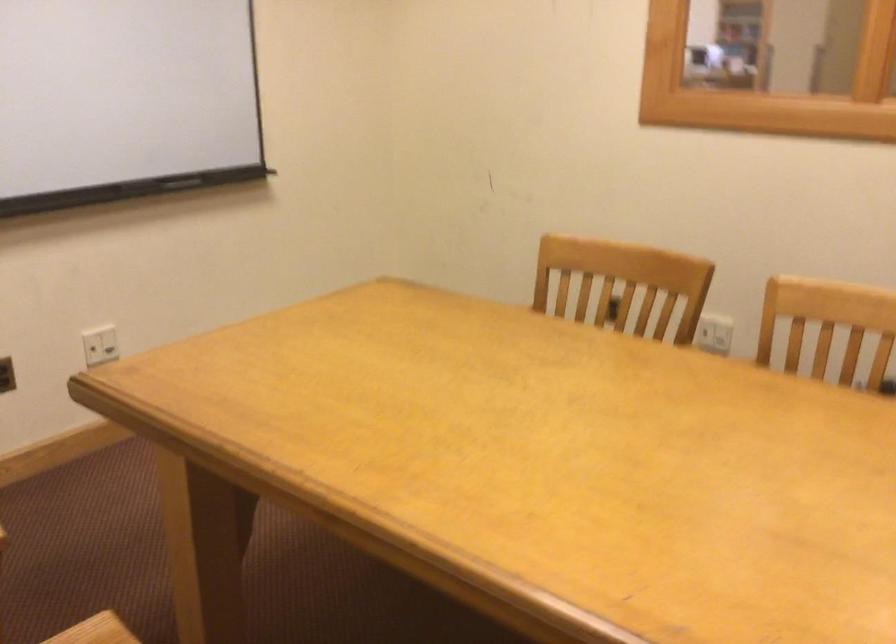
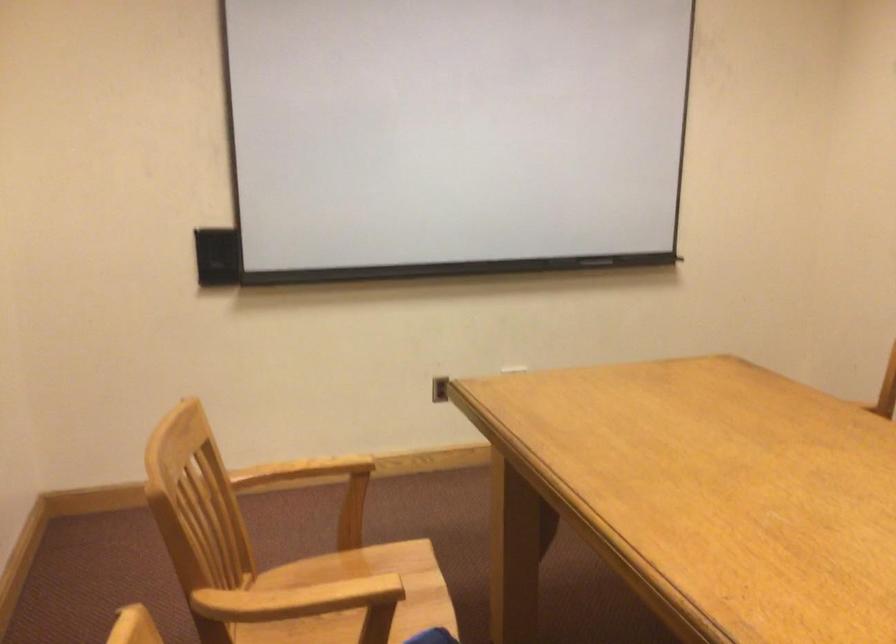
Question: The images are taken continuously from a first-person perspective. In which direction is your viewpoint rotating?

Choices:
 (A) Left
 (B) Right
 (C) Up
 (D) Down

Answer: (A)